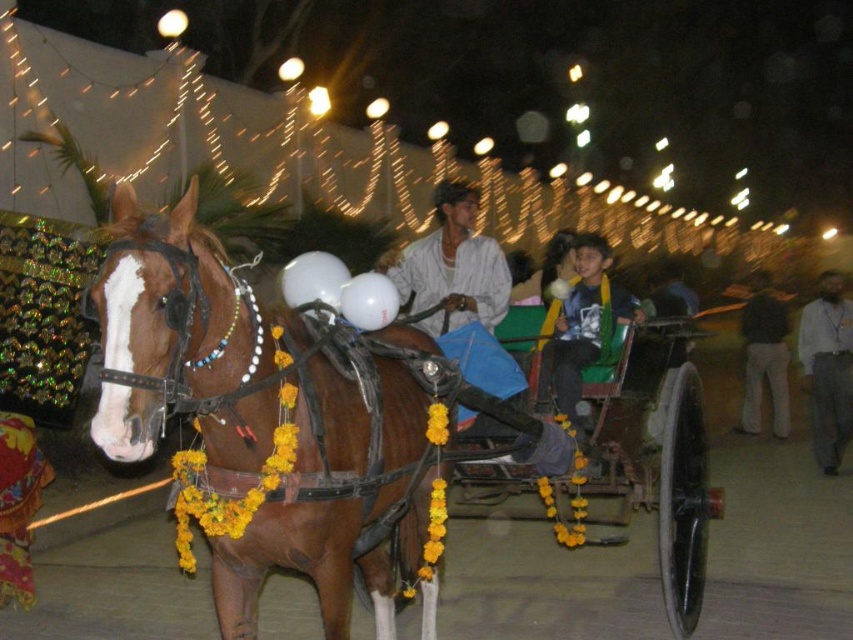
Does yellow fabric shirt at center have a greater width compared to dark gray sweater at right?

No, yellow fabric shirt at center is not wider than dark gray sweater at right.

In the scene shown: Between yellow fabric shirt at center and dark gray sweater at right, which one appears on the right side from the viewer's perspective?

From the viewer's perspective, dark gray sweater at right appears more on the right side.

Is point (561, 388) more distant than point (763, 298)?

No, (561, 388) is closer to viewer.

At what (x,y) coordinates should I click in order to perform the action: click on yellow fabric shirt at center. Please return your answer as a coordinate pair (x, y). The height and width of the screenshot is (640, 853). Looking at the image, I should click on (582, 324).

Is light brown fabric shirt at center above dark gray sweater at right?

No, light brown fabric shirt at center is not above dark gray sweater at right.

Is light brown fabric shirt at center bigger than dark gray sweater at right?

No.

Who is more distant from viewer, (508, 301) or (787, 387)?

The point (787, 387) is behind.

This screenshot has width=853, height=640. In order to click on light brown fabric shirt at center in this screenshot , I will do `click(454, 266)`.

Does yellow fabric shirt at center appear on the right side of beige fabric shirt at right?

In fact, yellow fabric shirt at center is to the left of beige fabric shirt at right.

Does yellow fabric shirt at center have a lesser height compared to beige fabric shirt at right?

Indeed, yellow fabric shirt at center has a lesser height compared to beige fabric shirt at right.

Find the location of a particular element. yellow fabric shirt at center is located at coordinates (582, 324).